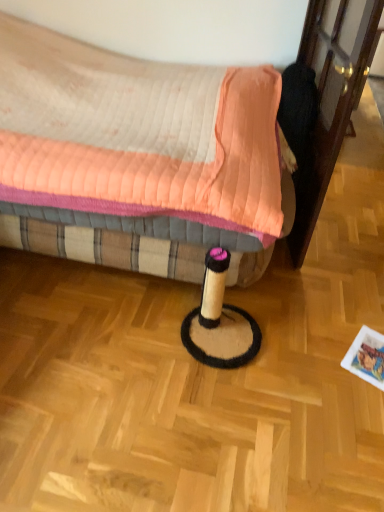
Question: From a real-world perspective, relative to transparent glass screen door at right, is quilted fabric bed at center vertically above or below?

Choices:
 (A) below
 (B) above

Answer: (A)

Question: Does point (79, 197) appear closer or farther from the camera than point (304, 172)?

Choices:
 (A) closer
 (B) farther

Answer: (A)

Question: Is quilted fabric bed at center wider or thinner than transparent glass screen door at right?

Choices:
 (A) wide
 (B) thin

Answer: (A)

Question: From a real-world perspective, relative to quilted fabric bed at center, is transparent glass screen door at right vertically above or below?

Choices:
 (A) above
 (B) below

Answer: (A)

Question: Is transparent glass screen door at right to the left or to the right of quilted fabric bed at center in the image?

Choices:
 (A) left
 (B) right

Answer: (B)

Question: Considering the positions of point (329, 58) and point (24, 240), is point (329, 58) closer or farther from the camera than point (24, 240)?

Choices:
 (A) farther
 (B) closer

Answer: (B)

Question: Would you say transparent glass screen door at right is inside or outside quilted fabric bed at center?

Choices:
 (A) outside
 (B) inside

Answer: (A)